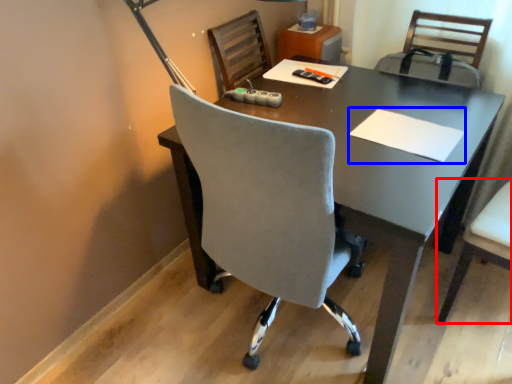
Question: Which object appears farthest to the camera in this image, chair (highlighted by a red box) or notepad (highlighted by a blue box)?

Choices:
 (A) chair
 (B) notepad

Answer: (B)